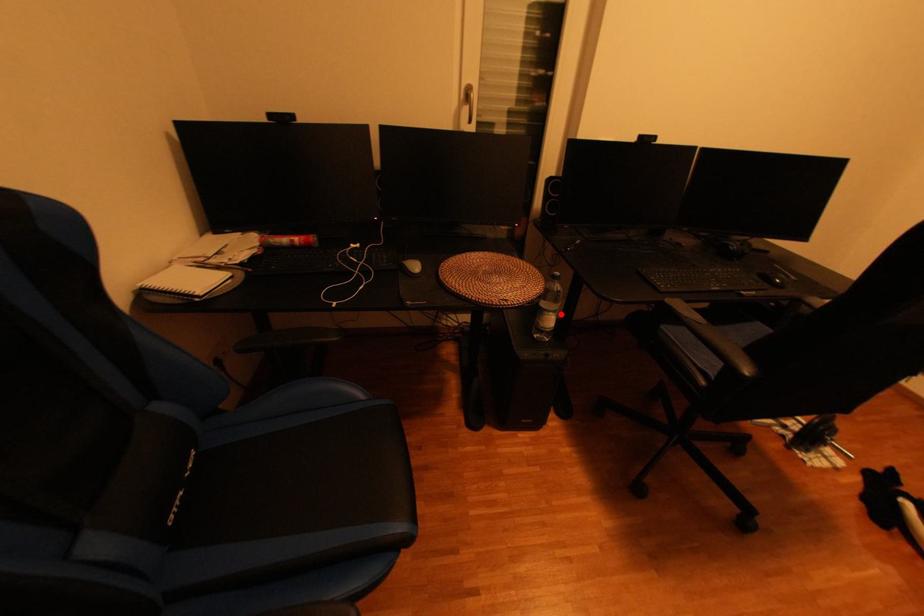
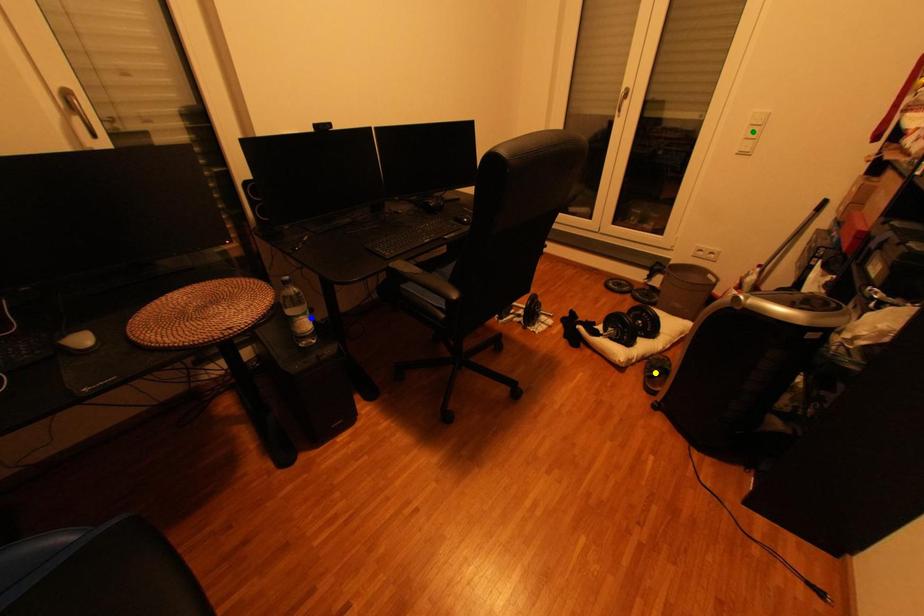
Question: I am providing you with two images of the same scene from different viewpoints. A red point is marked on the first image. You are given multiple points on the second image. Which point in image 2 is actually the same real-world point as the red point in image 1?

Choices:
 (A) blue point
 (B) green point
 (C) yellow point

Answer: (A)